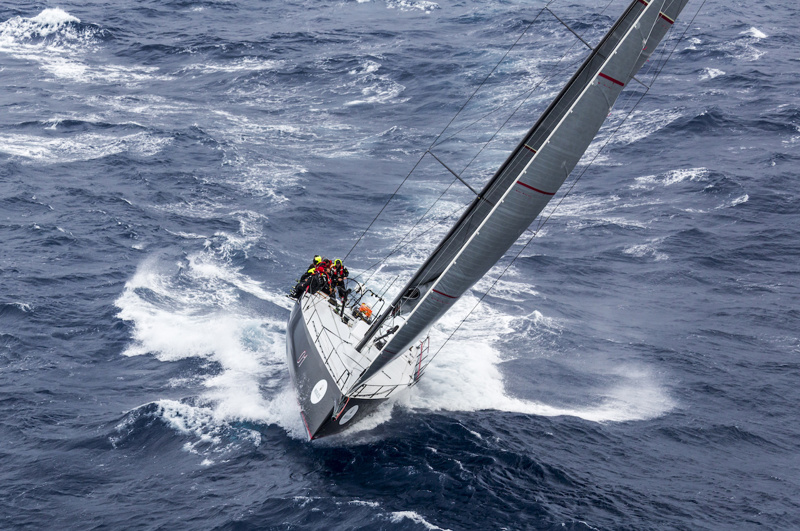
Identify the location of pulpit. (340, 376), (332, 352), (377, 385), (360, 393).